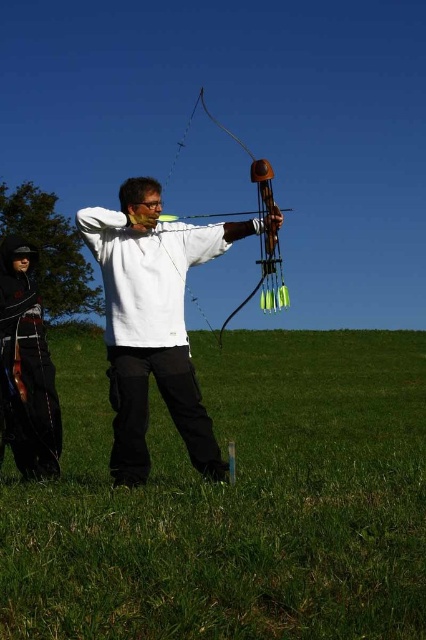
Question: Which point is farther to the camera?

Choices:
 (A) (294, 548)
 (B) (252, 211)
 (C) (3, 440)

Answer: (C)

Question: Is green grass at center below white matte archer at center?

Choices:
 (A) no
 (B) yes

Answer: (B)

Question: Does green grass at center have a larger size compared to wooden bow at center?

Choices:
 (A) no
 (B) yes

Answer: (B)

Question: Estimate the real-world distances between objects in this image. Which object is closer to the black leather jacket at lower left?

Choices:
 (A) green grass at center
 (B) wooden bow at center

Answer: (B)

Question: Which object is positioned farthest from the green grass at center?

Choices:
 (A) white matte archer at center
 (B) wooden bow at center

Answer: (B)

Question: Does green grass at center appear over white matte archer at center?

Choices:
 (A) no
 (B) yes

Answer: (A)